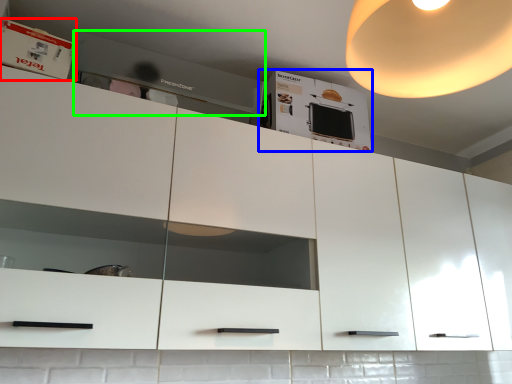
Question: Estimate the real-world distances between objects in this image. Which object is farther from cabinet (highlighted by a red box), cabinetry (highlighted by a blue box) or home appliance (highlighted by a green box)?

Choices:
 (A) cabinetry
 (B) home appliance

Answer: (A)